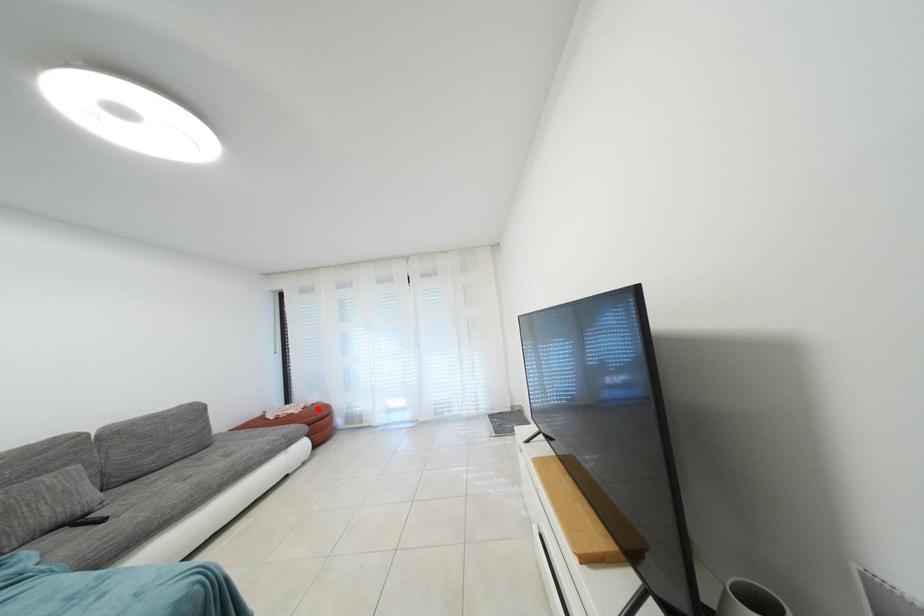
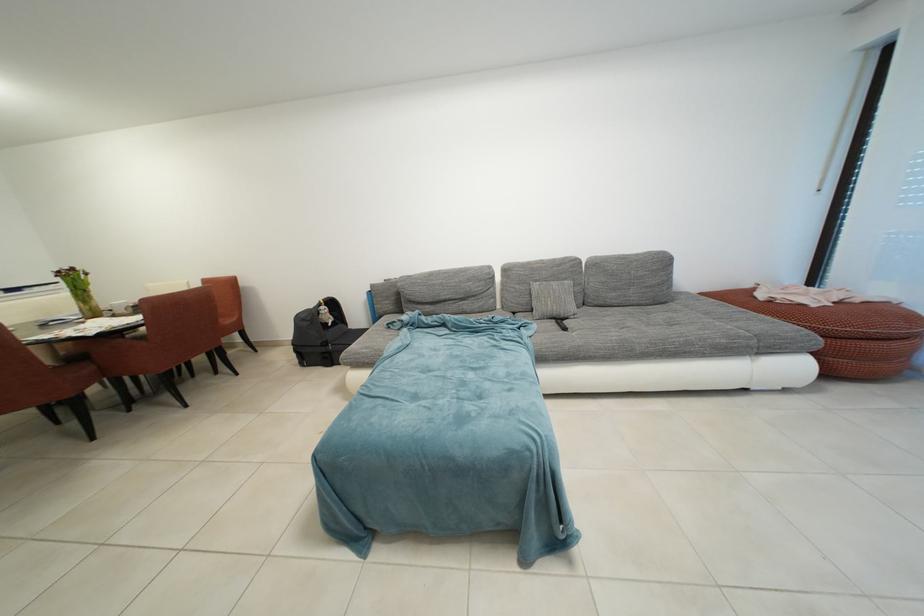
Question: I am providing you with two images of the same scene from different viewpoints. In image1, a red point is highlighted. Considering the same 3D point in image2, which of the following is correct?

Choices:
 (A) It is closer
 (B) It is farther

Answer: (B)